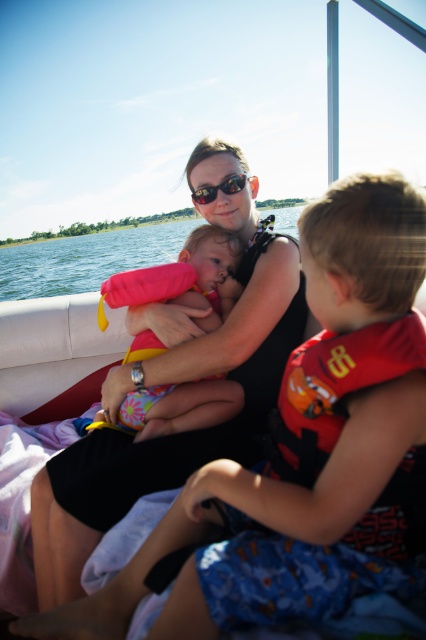
Question: Which of the following is the farthest from the observer?

Choices:
 (A) (140, 264)
 (B) (161, 419)
 (C) (258, 228)
 (D) (213, 198)

Answer: (C)

Question: Which point is farther to the camera?

Choices:
 (A) (x=238, y=170)
 (B) (x=293, y=474)
 (C) (x=89, y=252)

Answer: (C)

Question: Can you confirm if pink fabric life vest at center is positioned below clear blue water at center?

Choices:
 (A) no
 (B) yes

Answer: (B)

Question: Is red fabric life jacket at center wider than pink fabric life vest at center?

Choices:
 (A) no
 (B) yes

Answer: (A)

Question: Based on their relative distances, which object is nearer to the matte black swimsuit at center?

Choices:
 (A) clear blue water at center
 (B) pink fabric life vest at center
 (C) red fabric life jacket at center

Answer: (B)

Question: Does pink fabric life vest at center have a larger size compared to clear blue water at center?

Choices:
 (A) no
 (B) yes

Answer: (A)